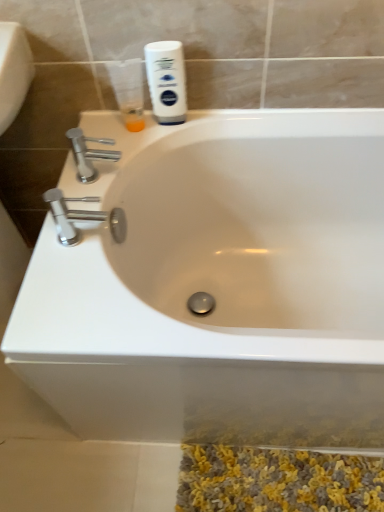
Where is `vacant space situated on the left part of white matte shaving cream at upper center`? vacant space situated on the left part of white matte shaving cream at upper center is located at coordinates (117, 141).